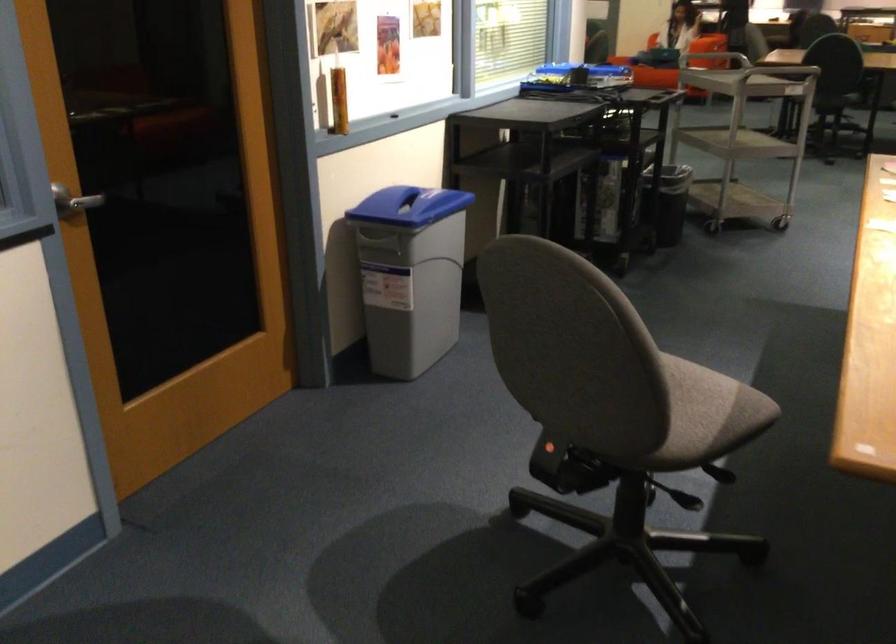
The height and width of the screenshot is (644, 896). What do you see at coordinates (73, 202) in the screenshot? I see `the silver door handle` at bounding box center [73, 202].